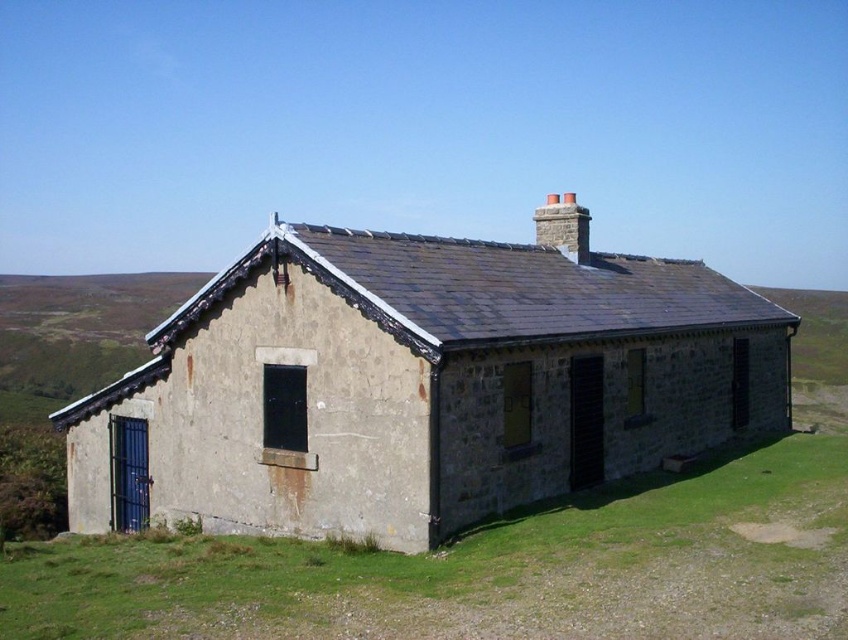
Question: Among these objects, which one is nearest to the camera?

Choices:
 (A) green grass at lower center
 (B) rustic stone cottage at center

Answer: (A)

Question: Which object appears closest to the camera in this image?

Choices:
 (A) rustic stone cottage at center
 (B) green grass at lower center

Answer: (B)

Question: Can you confirm if rustic stone cottage at center is positioned to the left of green grass at lower center?

Choices:
 (A) no
 (B) yes

Answer: (B)

Question: Among these points, which one is farthest from the camera?

Choices:
 (A) (534, 444)
 (B) (93, 560)

Answer: (A)

Question: Observing the image, what is the correct spatial positioning of rustic stone cottage at center in reference to green grass at lower center?

Choices:
 (A) right
 (B) left

Answer: (B)

Question: Is rustic stone cottage at center thinner than green grass at lower center?

Choices:
 (A) yes
 (B) no

Answer: (B)